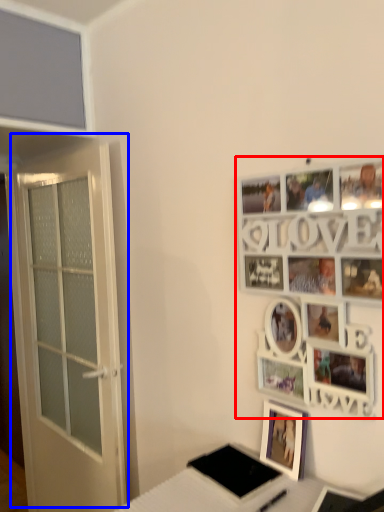
Question: Which object is closer to the camera taking this photo, picture frame (highlighted by a red box) or door (highlighted by a blue box)?

Choices:
 (A) picture frame
 (B) door

Answer: (A)